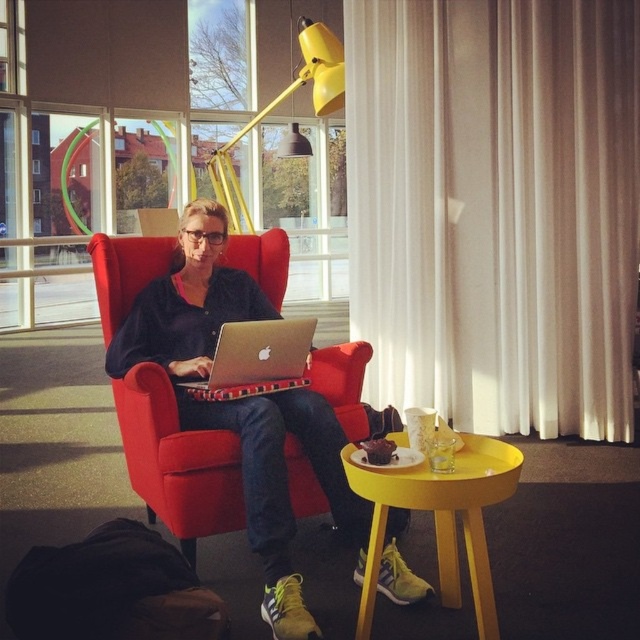
You are organizing a backpacking trip and need to pack your silver metallic laptop at center and black fabric bag at lower left. Which item should you place first into your luggage to ensure both fit properly?

You should place the black fabric bag at lower left first because it is larger than the silver metallic laptop at center, allowing you to fit both items properly.

You are a delivery person who needs to place a package between the black fabric bag at lower left and the silver metallic laptop at center. The package is 24 inches long. Can you fit it between them without moving either object?

The distance between the black fabric bag at lower left and the silver metallic laptop at center is 26.38 inches. Since the package is 24 inches long, it can fit between them as there is enough space.